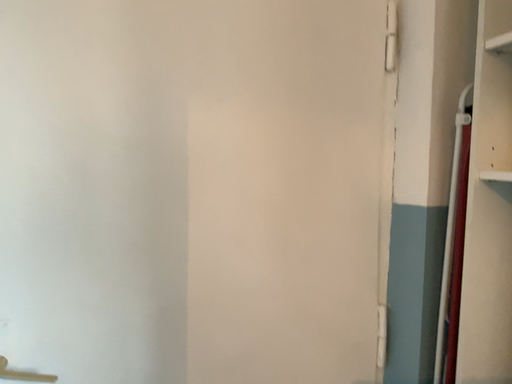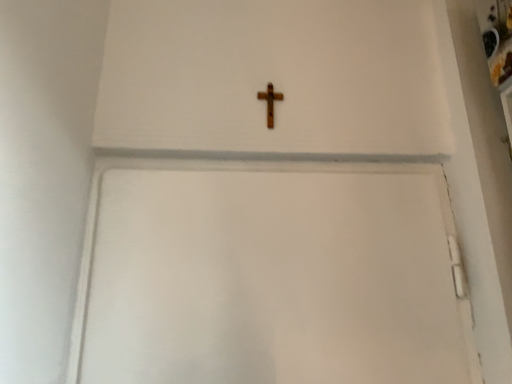
Question: How did the camera likely rotate when shooting the video?

Choices:
 (A) rotated downward
 (B) rotated upward

Answer: (B)